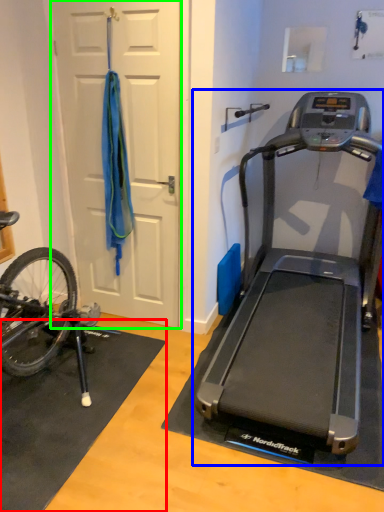
Question: Considering the real-world distances, which object is farthest from doormat (highlighted by a red box)? treadmill (highlighted by a blue box) or door (highlighted by a green box)?

Choices:
 (A) treadmill
 (B) door

Answer: (B)